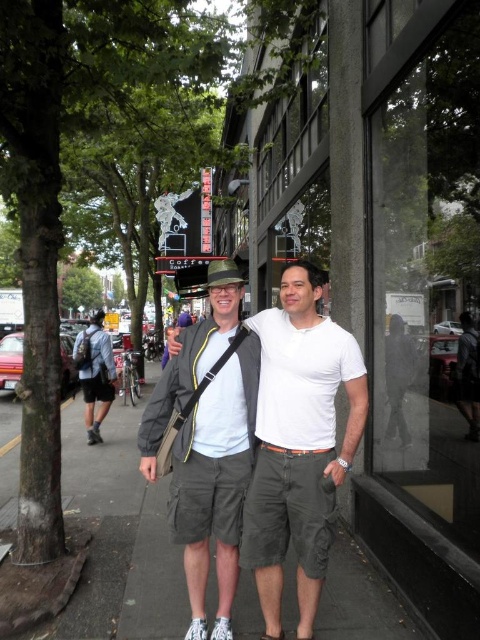
Is gray concrete sidewalk at center positioned in front of denim backpack at left?

Yes, it is.

Does gray concrete sidewalk at center lie behind denim backpack at left?

No, gray concrete sidewalk at center is closer to the viewer.

Is point (139, 538) less distant than point (95, 344)?

That is True.

This screenshot has height=640, width=480. Find the location of `gray concrete sidewalk at center`. gray concrete sidewalk at center is located at coordinates (118, 540).

Can you confirm if gray concrete sidewalk at center is positioned below matte gray shorts at center?

Yes.

Find the location of a particular element. gray concrete sidewalk at center is located at coordinates (118, 540).

Does matte gray shorts at center appear on the right side of denim backpack at left?

Yes, matte gray shorts at center is to the right of denim backpack at left.

Can you confirm if matte gray shorts at center is bigger than denim backpack at left?

Correct, matte gray shorts at center is larger in size than denim backpack at left.

This screenshot has width=480, height=640. What do you see at coordinates (299, 442) in the screenshot? I see `matte gray shorts at center` at bounding box center [299, 442].

Identify the location of matte gray shorts at center. (299, 442).